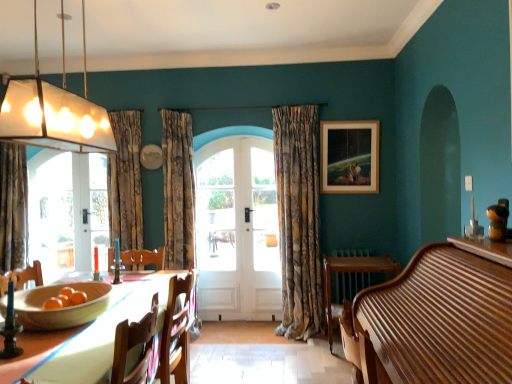
Where is `free point above wooden picture frame at upper right (from a real-world perspective)`? The height and width of the screenshot is (384, 512). free point above wooden picture frame at upper right (from a real-world perspective) is located at coordinates (346, 119).